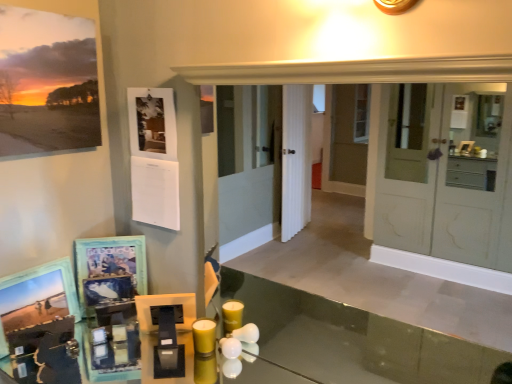
Question: Are wooden picture frame at lower left, which is counted as the 2th picture frame, starting from the bottom, and yellow matte candle at lower center located far from each other?

Choices:
 (A) yes
 (B) no

Answer: (B)

Question: Is wooden picture frame at lower left, which appears as the 2th picture frame when viewed from the top, at the left side of yellow matte candle at lower center?

Choices:
 (A) no
 (B) yes

Answer: (B)

Question: Considering the relative sizes of wooden picture frame at lower left, which is counted as the 2th picture frame, starting from the bottom, and yellow matte candle at lower center in the image provided, is wooden picture frame at lower left, which is counted as the 2th picture frame, starting from the bottom, wider than yellow matte candle at lower center?

Choices:
 (A) yes
 (B) no

Answer: (B)

Question: Does wooden picture frame at lower left, which is counted as the 2th picture frame, starting from the bottom, have a smaller size compared to yellow matte candle at lower center?

Choices:
 (A) no
 (B) yes

Answer: (A)

Question: Does wooden picture frame at lower left, which appears as the 2th picture frame when viewed from the top, have a lesser width compared to yellow matte candle at lower center?

Choices:
 (A) no
 (B) yes

Answer: (B)

Question: Considering the relative sizes of wooden picture frame at lower left, which is counted as the 2th picture frame, starting from the bottom, and yellow matte candle at lower center in the image provided, is wooden picture frame at lower left, which is counted as the 2th picture frame, starting from the bottom, shorter than yellow matte candle at lower center?

Choices:
 (A) no
 (B) yes

Answer: (A)

Question: Is yellow matte candle at lower center not close to wooden picture frame at lower left, which is counted as the 2th picture frame, starting from the bottom?

Choices:
 (A) yes
 (B) no

Answer: (B)

Question: Is the depth of yellow matte candle at lower center greater than that of wooden picture frame at lower left, which is counted as the 2th picture frame, starting from the bottom?

Choices:
 (A) no
 (B) yes

Answer: (A)

Question: From the image's perspective, is yellow matte candle at lower center on top of wooden picture frame at lower left, which appears as the 2th picture frame when viewed from the top?

Choices:
 (A) yes
 (B) no

Answer: (B)

Question: Is yellow matte candle at lower center wider than wooden picture frame at lower left, which appears as the 2th picture frame when viewed from the top?

Choices:
 (A) no
 (B) yes

Answer: (B)

Question: Considering the relative sizes of yellow matte candle at lower center and wooden picture frame at lower left, which is counted as the 2th picture frame, starting from the bottom, in the image provided, is yellow matte candle at lower center bigger than wooden picture frame at lower left, which is counted as the 2th picture frame, starting from the bottom,?

Choices:
 (A) no
 (B) yes

Answer: (A)

Question: Considering the relative sizes of yellow matte candle at lower center and wooden picture frame at lower left, which is counted as the 2th picture frame, starting from the bottom, in the image provided, is yellow matte candle at lower center smaller than wooden picture frame at lower left, which is counted as the 2th picture frame, starting from the bottom,?

Choices:
 (A) no
 (B) yes

Answer: (B)

Question: Is wooden picture frame at lower left, which is counted as the 2th picture frame, starting from the bottom, completely or partially outside of matte paper print at upper left, the 1th picture frame positioned from the top?

Choices:
 (A) yes
 (B) no

Answer: (A)